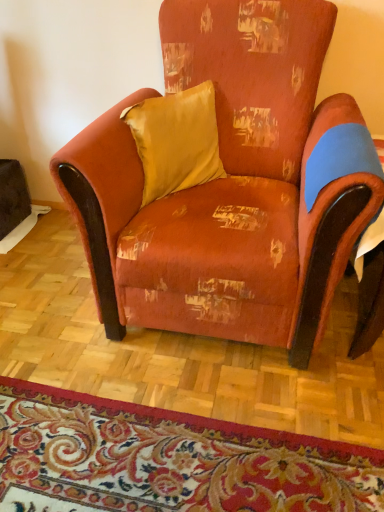
Where is `blank space situated above floral carpet at lower center (from a real-world perspective)`? The image size is (384, 512). blank space situated above floral carpet at lower center (from a real-world perspective) is located at coordinates (143, 454).